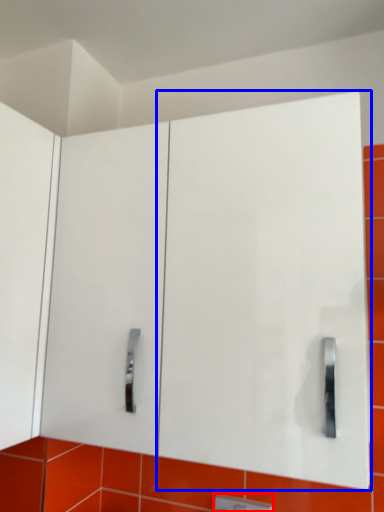
Question: Which point is closer to the camera, light switch (highlighted by a red box) or glass door (highlighted by a blue box)?

Choices:
 (A) light switch
 (B) glass door

Answer: (B)